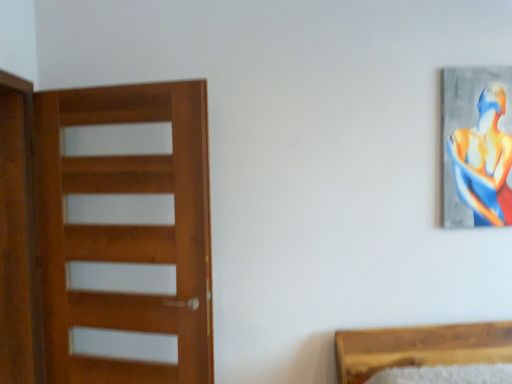
This screenshot has width=512, height=384. Find the location of `brown wooden screen door at left`. brown wooden screen door at left is located at coordinates (18, 240).

Where is `metallic silver painting at upper right`? metallic silver painting at upper right is located at coordinates (477, 146).

From the picture: From the image's perspective, does wooden door at left appear higher than metallic silver painting at upper right?

No, from the image's perspective, wooden door at left is not above metallic silver painting at upper right.

Which is behind, point (94, 174) or point (458, 219)?

The point (458, 219) is farther from the camera.

How different are the orientations of wooden door at left and metallic silver painting at upper right in degrees?

They differ by 28.6 degrees in their facing directions.

Considering the sizes of objects wooden door at left and metallic silver painting at upper right in the image provided, who is thinner, wooden door at left or metallic silver painting at upper right?

Thinner between the two is metallic silver painting at upper right.

Looking at the image, does brown wooden screen door at left seem bigger or smaller compared to metallic silver painting at upper right?

Considering their sizes, brown wooden screen door at left takes up more space than metallic silver painting at upper right.

Considering the positions of point (25, 335) and point (462, 76), is point (25, 335) closer or farther from the camera than point (462, 76)?

Point (25, 335) is closer to the camera than point (462, 76).

From the picture: From a real-world perspective, which object stands above the other?

From a 3D spatial view, metallic silver painting at upper right is above.

Is brown wooden screen door at left in front of wooden door at left?

No, brown wooden screen door at left is further to the viewer.

Is brown wooden screen door at left taller or shorter than wooden door at left?

brown wooden screen door at left is taller than wooden door at left.

Which of these two, brown wooden screen door at left or wooden door at left, is wider?

wooden door at left.

Would you say brown wooden screen door at left is to the left or to the right of wooden door at left in the picture?

From the image, it's evident that brown wooden screen door at left is to the left of wooden door at left.

Is wooden door at left completely or partially inside metallic silver painting at upper right?

Actually, wooden door at left is outside metallic silver painting at upper right.

Considering the relative sizes of metallic silver painting at upper right and wooden door at left in the image provided, is metallic silver painting at upper right thinner than wooden door at left?

Yes, metallic silver painting at upper right is thinner than wooden door at left.

In the scene shown: Measure the distance between metallic silver painting at upper right and wooden door at left.

1.53 meters.

Which is more to the right, metallic silver painting at upper right or wooden door at left?

metallic silver painting at upper right.

Is metallic silver painting at upper right far away from brown wooden screen door at left?

Absolutely, metallic silver painting at upper right is distant from brown wooden screen door at left.

Is metallic silver painting at upper right closer to camera compared to brown wooden screen door at left?

No, it is behind brown wooden screen door at left.

From the picture: Which of these two, metallic silver painting at upper right or brown wooden screen door at left, is wider?

brown wooden screen door at left is wider.

Is metallic silver painting at upper right turned away from brown wooden screen door at left?

metallic silver painting at upper right does not have its back to brown wooden screen door at left.

Considering their positions, is wooden door at left located in front of or behind brown wooden screen door at left?

wooden door at left is positioned closer to the viewer than brown wooden screen door at left.

Does wooden door at left turn towards brown wooden screen door at left?

Yes, wooden door at left is facing brown wooden screen door at left.

From a real-world perspective, which is physically below, wooden door at left or brown wooden screen door at left?

From a 3D spatial view, wooden door at left is below.

Considering the sizes of objects wooden door at left and brown wooden screen door at left in the image provided, who is thinner, wooden door at left or brown wooden screen door at left?

Thinner between the two is brown wooden screen door at left.

Locate an element on the screen. This screenshot has height=384, width=512. door below the metallic silver painting at upper right (from a real-world perspective) is located at coordinates tap(127, 231).

Find the location of a particular element. The image size is (512, 384). picture frame on the right of brown wooden screen door at left is located at coordinates (477, 146).

Which object lies nearer to the anchor point brown wooden screen door at left, wooden door at left or metallic silver painting at upper right?

Based on the image, wooden door at left appears to be nearer to brown wooden screen door at left.

Based on their spatial positions, is metallic silver painting at upper right or brown wooden screen door at left further from wooden door at left?

Based on the image, metallic silver painting at upper right appears to be further to wooden door at left.

Estimate the real-world distances between objects in this image. Which object is further from metallic silver painting at upper right, wooden door at left or brown wooden screen door at left?

brown wooden screen door at left lies further to metallic silver painting at upper right than the other object.

Which object lies nearer to the anchor point wooden door at left, brown wooden screen door at left or metallic silver painting at upper right?

Among the two, brown wooden screen door at left is located nearer to wooden door at left.

Based on their spatial positions, is metallic silver painting at upper right or wooden door at left further from brown wooden screen door at left?

metallic silver painting at upper right is further to brown wooden screen door at left.

When comparing their distances from metallic silver painting at upper right, does brown wooden screen door at left or wooden door at left seem further?

Based on the image, brown wooden screen door at left appears to be further to metallic silver painting at upper right.

Find the location of a particular element. The height and width of the screenshot is (384, 512). door between brown wooden screen door at left and metallic silver painting at upper right from left to right is located at coordinates 127,231.